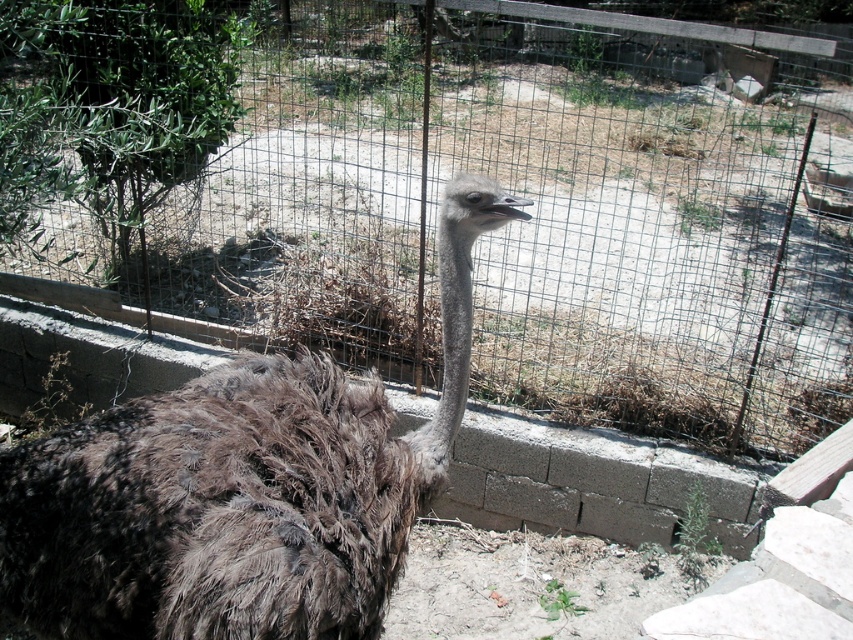
Is brown fuzzy ostrich at center behind brown feathered ostrich head at center?

No, it is not.

The height and width of the screenshot is (640, 853). I want to click on brown fuzzy ostrich at center, so click(229, 500).

At what (x,y) coordinates should I click in order to perform the action: click on brown fuzzy ostrich at center. Please return your answer as a coordinate pair (x, y). This screenshot has height=640, width=853. Looking at the image, I should click on (229, 500).

From the picture: Does wire mesh fence at center come behind brown fuzzy ostrich at center?

Yes, wire mesh fence at center is behind brown fuzzy ostrich at center.

Who is taller, wire mesh fence at center or brown fuzzy ostrich at center?

Standing taller between the two is wire mesh fence at center.

Who is more distant from viewer, (625, 300) or (183, 586)?

Point (625, 300)

The height and width of the screenshot is (640, 853). In order to click on wire mesh fence at center in this screenshot , I will do `click(450, 177)`.

Is wire mesh fence at center above brown feathered ostrich head at center?

Indeed, wire mesh fence at center is positioned over brown feathered ostrich head at center.

Which is more to the left, wire mesh fence at center or brown feathered ostrich head at center?

brown feathered ostrich head at center

Which is in front, point (595, 260) or point (476, 204)?

Positioned in front is point (476, 204).

I want to click on wire mesh fence at center, so click(450, 177).